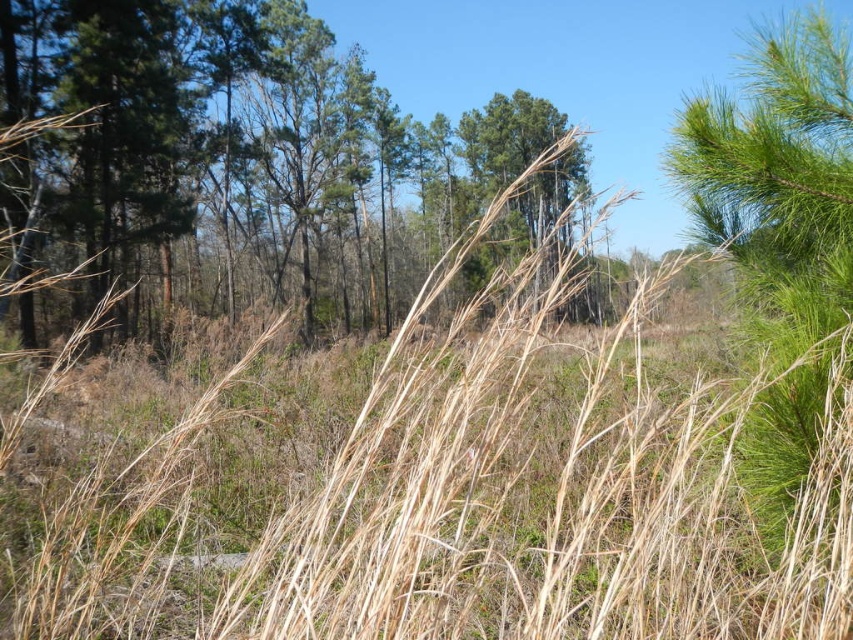
Question: Observing the image, what is the correct spatial positioning of green leafy tree at center in reference to green needle-like at right?

Choices:
 (A) below
 (B) above

Answer: (B)

Question: Which of the following is the farthest from the observer?

Choices:
 (A) (498, 156)
 (B) (822, 328)

Answer: (A)

Question: Is green leafy tree at center above green needle-like at right?

Choices:
 (A) yes
 (B) no

Answer: (A)

Question: Does green leafy tree at center have a larger size compared to green needle-like at right?

Choices:
 (A) no
 (B) yes

Answer: (B)